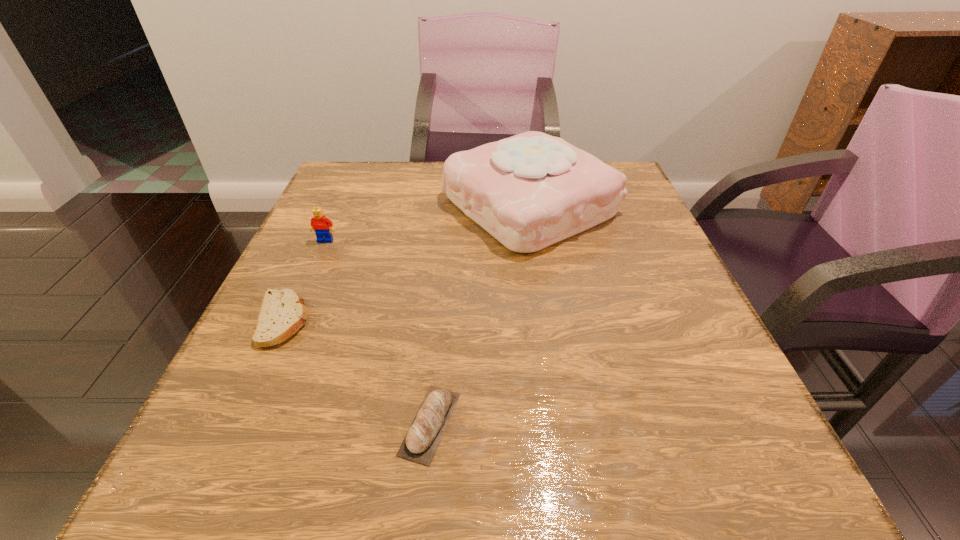
Find the location of `free space between the Lego and the tallest object`. free space between the Lego and the tallest object is located at coordinates (427, 223).

Find the location of a particular element. free space between the cake and the third shortest object is located at coordinates (427, 223).

Where is `the closest object relative to the Lego`? The height and width of the screenshot is (540, 960). the closest object relative to the Lego is located at coordinates (282, 313).

This screenshot has width=960, height=540. Find the location of `object that is the second closest to the second tallest object`. object that is the second closest to the second tallest object is located at coordinates (529, 191).

You are a GUI agent. You are given a task and a screenshot of the screen. Output one action in this format:
    pyautogui.click(x=<x>, y=<y>)
    Task: Click on the vacant space that satisfies the following two spatial constraints: 1. on the front-facing side of the taller pita bread; 2. on the right side of the third shortest object
    This screenshot has height=540, width=960.
    Given the screenshot: What is the action you would take?
    pyautogui.click(x=245, y=423)

Identify the location of free region that satisfies the following two spatial constraints: 1. on the front-facing side of the Lego; 2. on the left side of the taller pita bread. (245, 423).

The width and height of the screenshot is (960, 540). Identify the location of vacant point that satisfies the following two spatial constraints: 1. on the front-facing side of the Lego; 2. on the left side of the nearest object. (245, 423).

This screenshot has height=540, width=960. In order to click on vacant space that satisfies the following two spatial constraints: 1. on the front-facing side of the second tallest object; 2. on the left side of the second shortest object in this screenshot , I will do `click(245, 423)`.

You are a GUI agent. You are given a task and a screenshot of the screen. Output one action in this format:
    pyautogui.click(x=<x>, y=<y>)
    Task: Click on the vacant space that satisfies the following two spatial constraints: 1. on the front side of the left pita bread; 2. on the right side of the taller pita bread
    
    Given the screenshot: What is the action you would take?
    pyautogui.click(x=235, y=423)